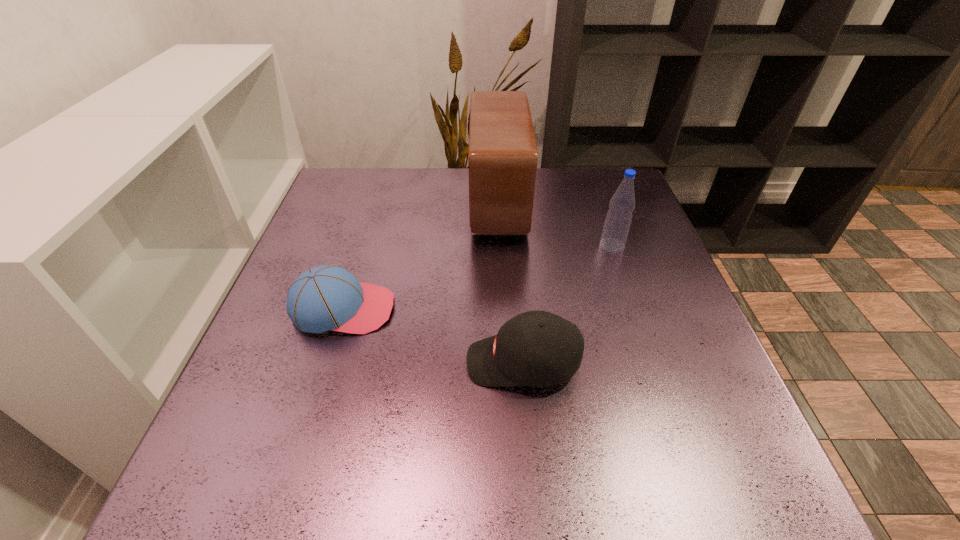
I want to click on empty space that is in between the right baseball cap and the leftmost object, so click(x=433, y=335).

Locate an element on the screen. Image resolution: width=960 pixels, height=540 pixels. empty space between the left baseball cap and the radio receiver is located at coordinates (420, 256).

You are a GUI agent. You are given a task and a screenshot of the screen. Output one action in this format:
    pyautogui.click(x=<x>, y=<y>)
    Task: Click on the object identified as the third closest to the right baseball cap
    Image resolution: width=960 pixels, height=540 pixels.
    Given the screenshot: What is the action you would take?
    pyautogui.click(x=503, y=156)

Locate which object ranks in proximity to the leftmost object. Please provide its 2D coordinates. Your answer should be formatted as a tuple, i.e. [(x, y)], where the tuple contains the x and y coordinates of a point satisfying the conditions above.

[(536, 348)]

Locate an element on the screen. The height and width of the screenshot is (540, 960). free space in the image that satisfies the following two spatial constraints: 1. on the front side of the third shortest object; 2. on the front-facing side of the left baseball cap is located at coordinates (634, 309).

I want to click on vacant position in the image that satisfies the following two spatial constraints: 1. on the front side of the rightmost object; 2. on the front-facing side of the left baseball cap, so click(634, 309).